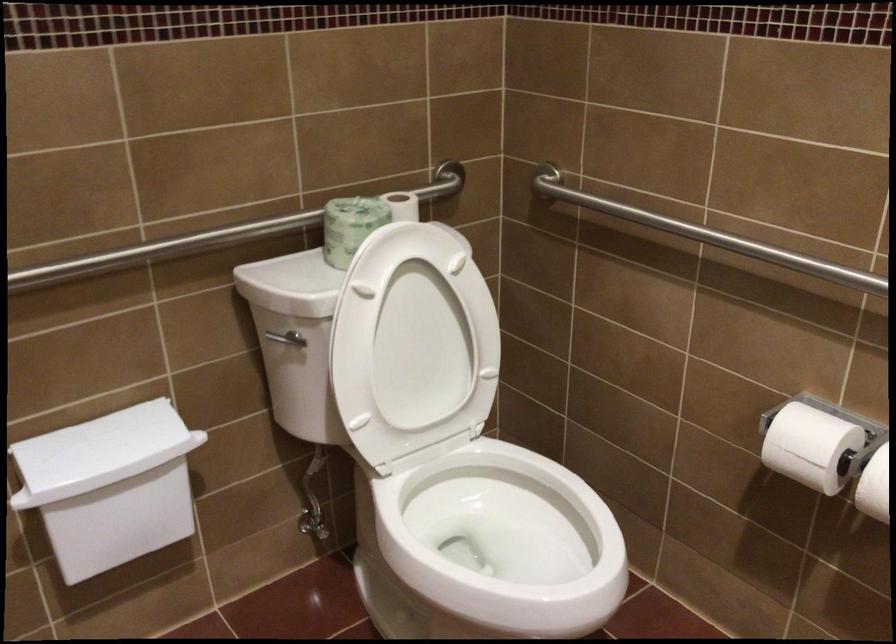
This screenshot has height=644, width=896. Identify the location of white dispenser lid. (100, 450).